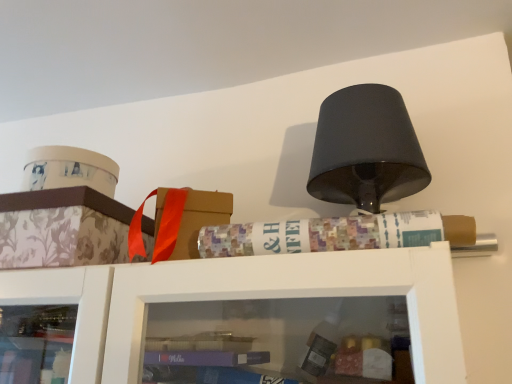
Question: Does floral-patterned cardboard box at left have a larger size compared to multicolored paper at upper center?

Choices:
 (A) yes
 (B) no

Answer: (A)

Question: Is floral-patterned cardboard box at left located outside multicolored paper at upper center?

Choices:
 (A) no
 (B) yes

Answer: (B)

Question: Considering the relative positions of floral-patterned cardboard box at left and multicolored paper at upper center in the image provided, is floral-patterned cardboard box at left to the right of multicolored paper at upper center from the viewer's perspective?

Choices:
 (A) yes
 (B) no

Answer: (B)

Question: Can you confirm if floral-patterned cardboard box at left is shorter than multicolored paper at upper center?

Choices:
 (A) no
 (B) yes

Answer: (A)

Question: From a real-world perspective, does floral-patterned cardboard box at left sit lower than multicolored paper at upper center?

Choices:
 (A) no
 (B) yes

Answer: (A)

Question: From the image's perspective, would you say floral-patterned cardboard box at left is shown under multicolored paper at upper center?

Choices:
 (A) yes
 (B) no

Answer: (A)

Question: From the image's perspective, is multicolored paper at upper center below floral-patterned cardboard box at left?

Choices:
 (A) yes
 (B) no

Answer: (B)

Question: Are multicolored paper at upper center and floral-patterned cardboard box at left located far from each other?

Choices:
 (A) no
 (B) yes

Answer: (A)

Question: Would you say multicolored paper at upper center is outside floral-patterned cardboard box at left?

Choices:
 (A) yes
 (B) no

Answer: (A)

Question: Does multicolored paper at upper center have a smaller size compared to floral-patterned cardboard box at left?

Choices:
 (A) no
 (B) yes

Answer: (B)

Question: Is multicolored paper at upper center oriented towards floral-patterned cardboard box at left?

Choices:
 (A) no
 (B) yes

Answer: (A)

Question: Is multicolored paper at upper center oriented away from floral-patterned cardboard box at left?

Choices:
 (A) no
 (B) yes

Answer: (A)

Question: Is floral-patterned cardboard box at left in front of or behind multicolored paper at upper center in the image?

Choices:
 (A) behind
 (B) front

Answer: (A)